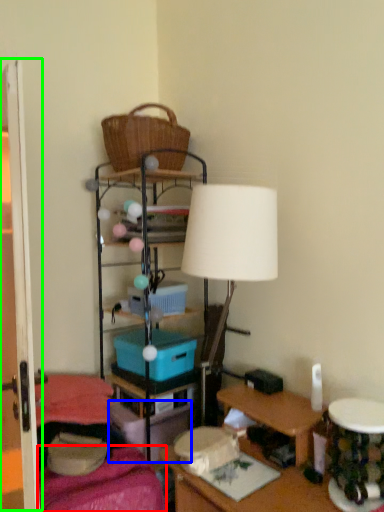
Question: Estimate the real-world distances between objects in this image. Which object is closer to bedding (highlighted by a red box), storage box (highlighted by a blue box) or glass door (highlighted by a green box)?

Choices:
 (A) storage box
 (B) glass door

Answer: (A)